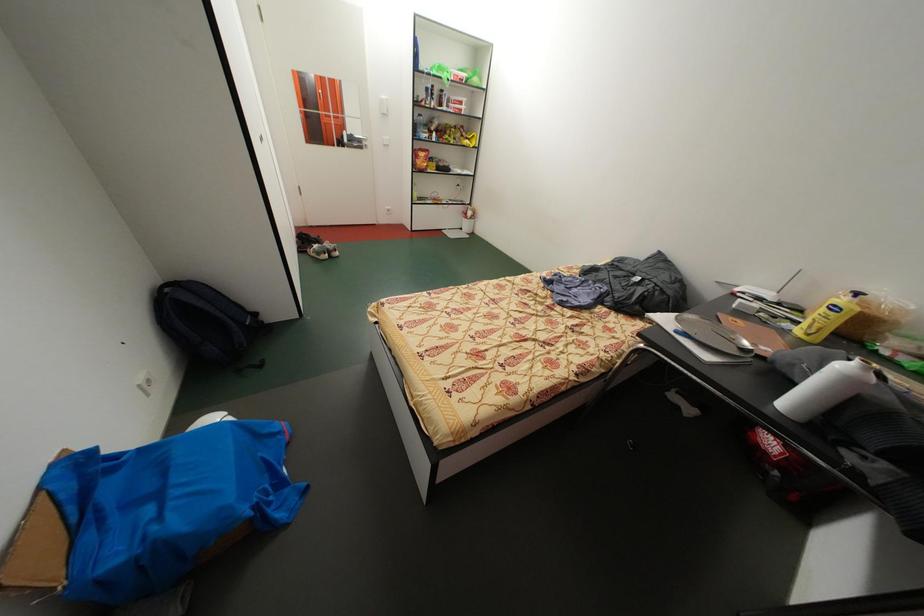
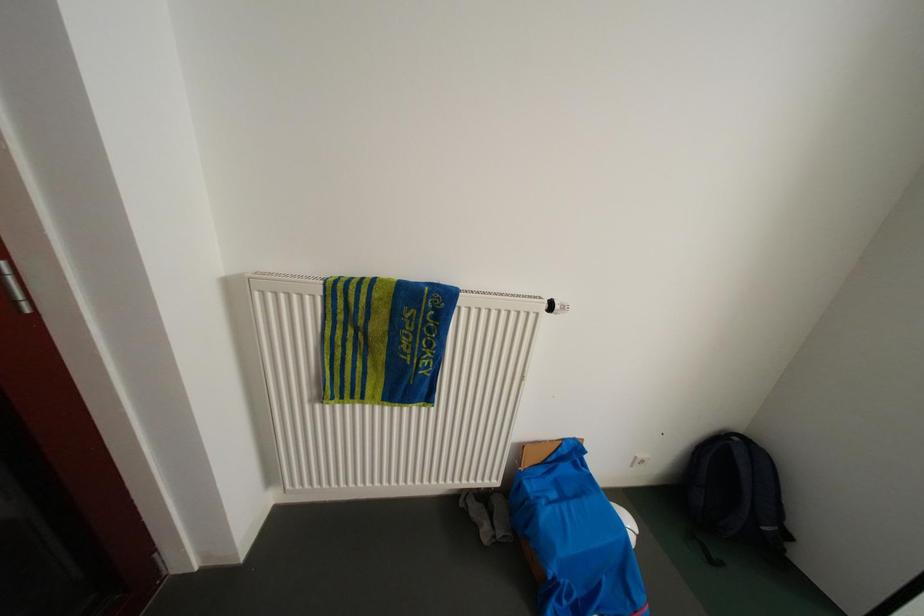
In the scene shown: First-person continuous shooting, in which direction is the camera rotating?

The rotation direction of the camera is left-down.